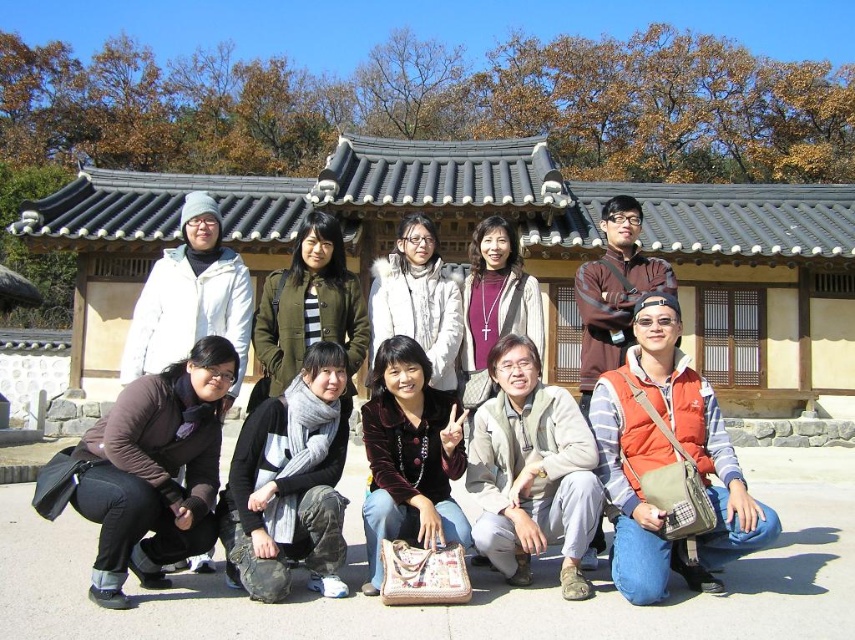
Question: Does gray wool scarf at center appear over velvet brown jacket at lower center?

Choices:
 (A) yes
 (B) no

Answer: (A)

Question: Observing the image, what is the correct spatial positioning of beige fabric jacket at lower center in reference to white wool scarf at center?

Choices:
 (A) below
 (B) above

Answer: (A)

Question: Can you confirm if orange fabric vest at lower right is smaller than gray wool scarf at center?

Choices:
 (A) yes
 (B) no

Answer: (A)

Question: Which point appears closest to the camera in this image?

Choices:
 (A) (387, 468)
 (B) (342, 449)
 (C) (632, 493)
 (D) (612, 200)

Answer: (C)

Question: Which object is the closest to the white wool scarf at center?

Choices:
 (A) brown wool sweater at center
 (B) velvet brown jacket at lower center
 (C) beige fabric jacket at lower center
 (D) orange fabric vest at lower right

Answer: (B)

Question: Among these objects, which one is farthest from the camera?

Choices:
 (A) white wool scarf at center
 (B) brown wool sweater at center

Answer: (B)